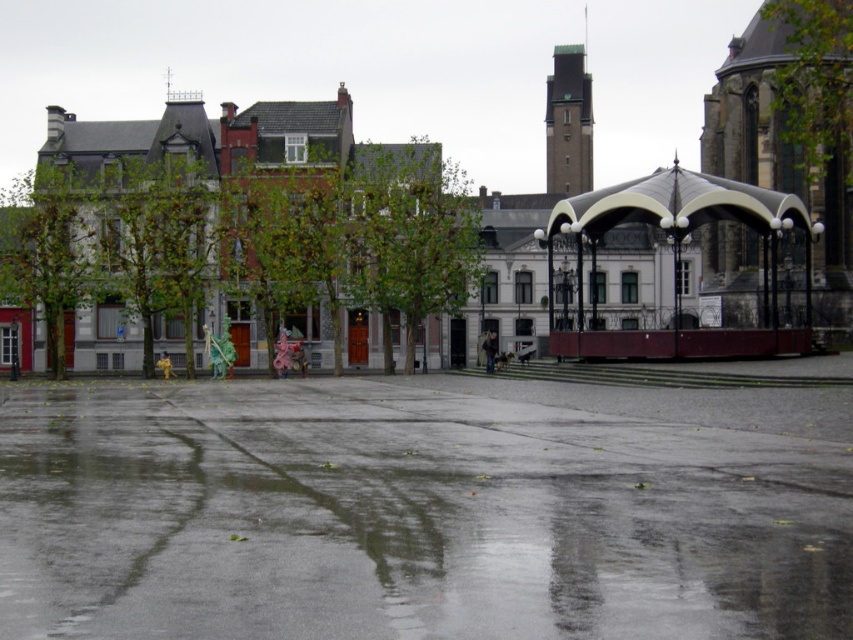
You are a delivery person trying to avoid getting your shoes wet. You see the glossy concrete puddle at center and the metallic silver canopy at center right. Which object should you walk towards to stay dry?

You should walk towards the metallic silver canopy at center right because the glossy concrete puddle at center is to the left of it, meaning the canopy is on the dry ground to the right.

You are standing at the edge of the wet urban square and want to walk to the middle. Is the glossy concrete puddle at center in your path?

The glossy concrete puddle at center is located at point (422, 513), which is directly in the middle of the square. Therefore, walking to the middle would place you directly on the puddle, so yes, it is in your path.